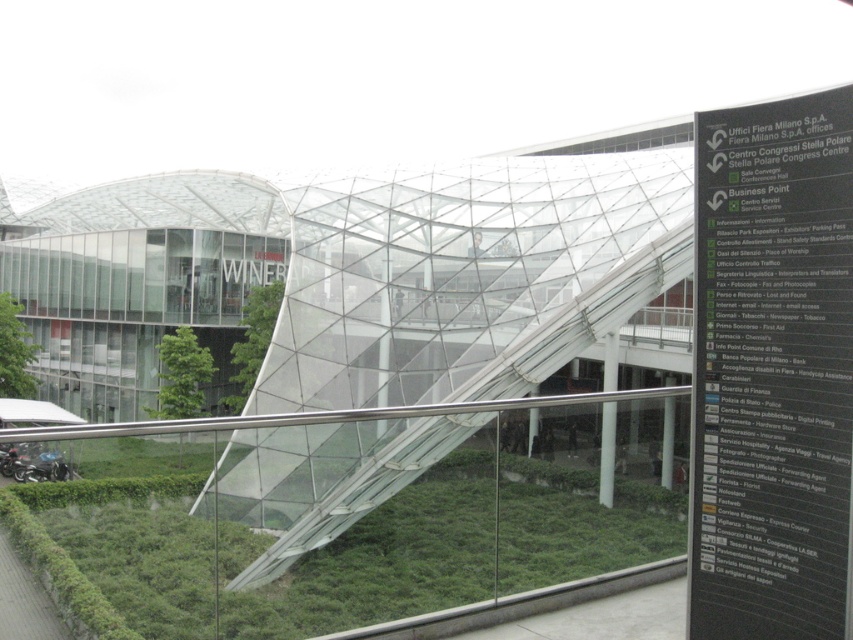
You are standing at the entrance of the convention center and see the point marked at coordinates [335,545]. What is located at that point?

The point at coordinates [335,545] indicates green leafy grass at lower center.

Looking at this image, you are a visitor approaching the convention center and notice the black plastic sign at right and the green leafy grass at lower center. Which object appears narrower in the image?

The black plastic sign at right has a lesser width compared to the green leafy grass at lower center, so the black plastic sign at right appears narrower.